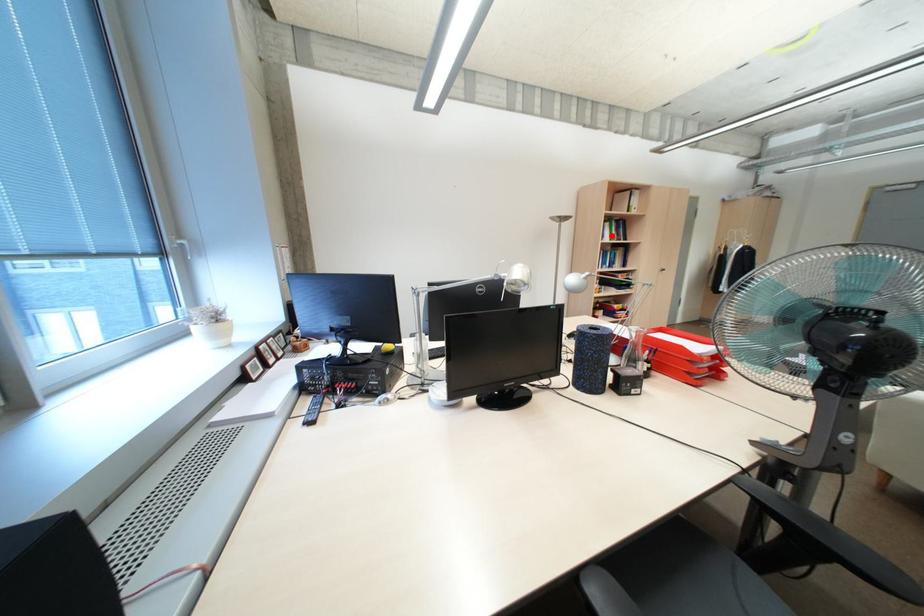
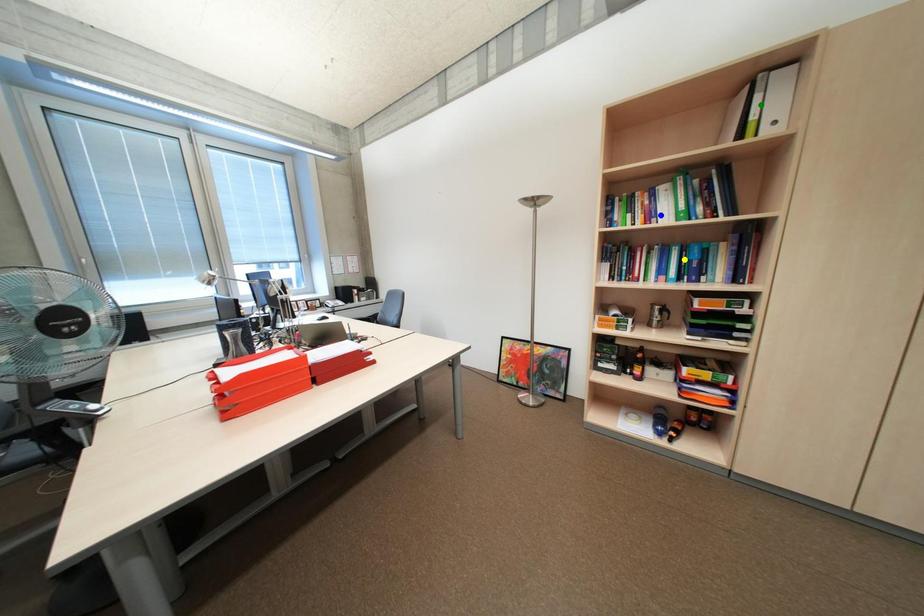
Question: I am providing you with two images of the same scene from different viewpoints. A red point is marked on the first image. You are given multiple points on the second image. Which spot in image 2 lines up with the point in image 1?

Choices:
 (A) yellow point
 (B) blue point
 (C) green point

Answer: (B)